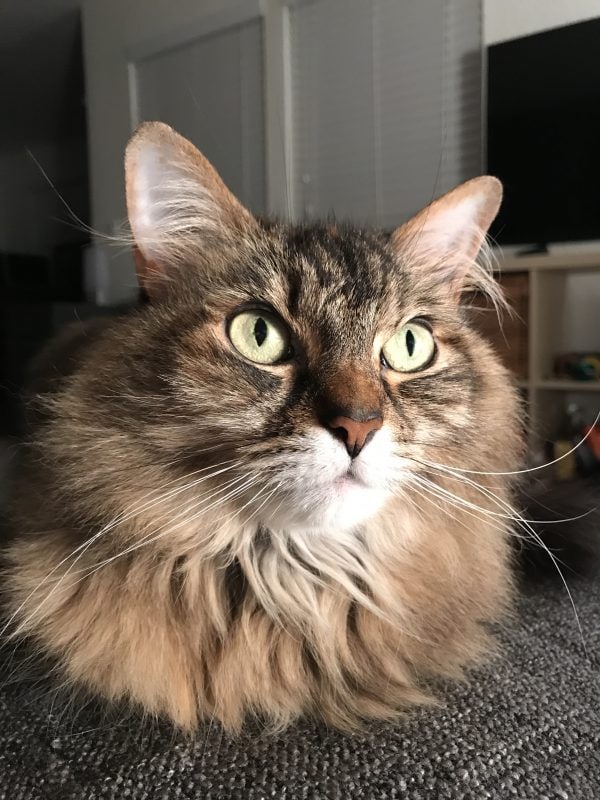
Locate an element on the screen. The height and width of the screenshot is (800, 600). shelf/stand is located at coordinates (565, 264).